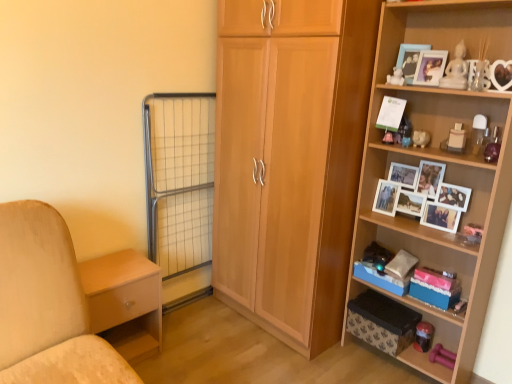
Image resolution: width=512 pixels, height=384 pixels. I want to click on vacant area that lies between light brown wood cupboard at center and wooden shelf at right, the 1th shelf ordered from the bottom, so click(x=350, y=366).